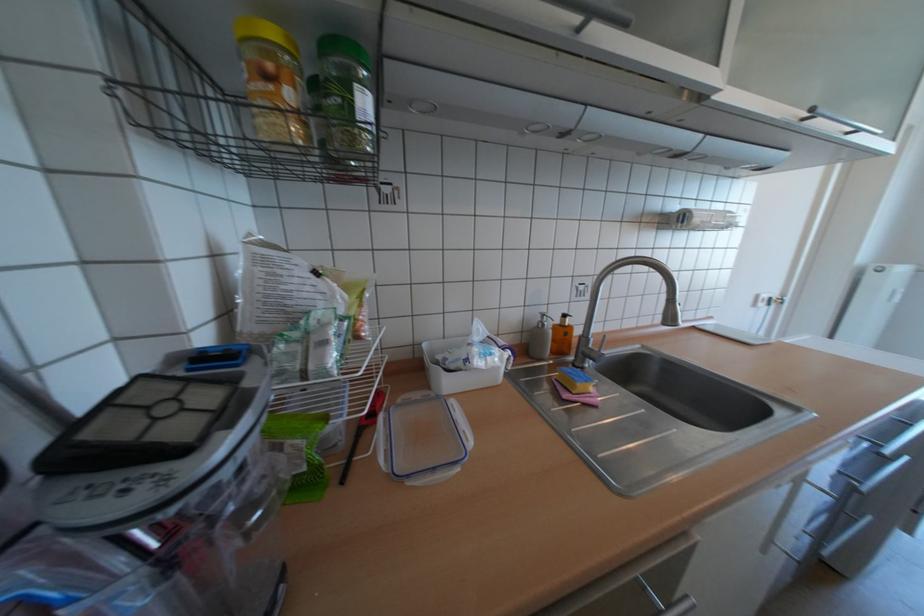
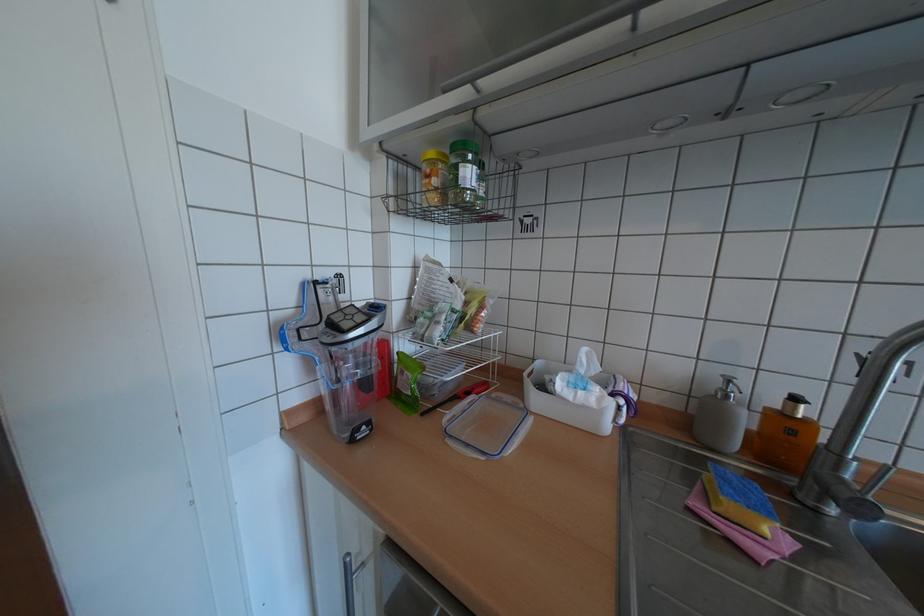
In the second image, find the point that corresponds to (x=601, y=349) in the first image.

(852, 480)